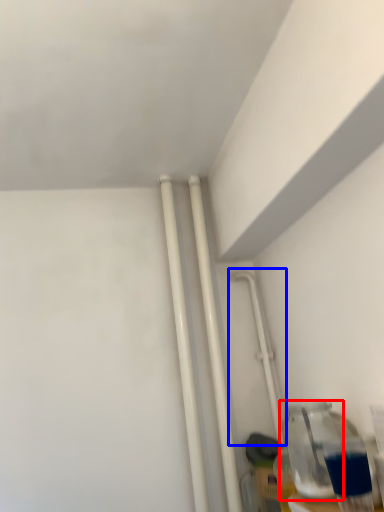
Question: Among these objects, which one is nearest to the camera, bottle (highlighted by a red box) or water pipe (highlighted by a blue box)?

Choices:
 (A) bottle
 (B) water pipe

Answer: (A)